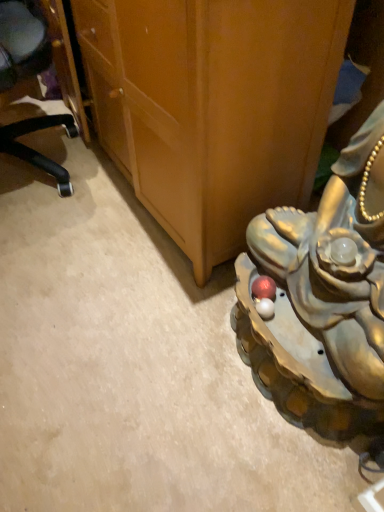
What do you see at coordinates (321, 297) in the screenshot? I see `metallic gold statue at lower right` at bounding box center [321, 297].

Identify the location of metallic gold statue at lower right. This screenshot has width=384, height=512. (321, 297).

You are a GUI agent. You are given a task and a screenshot of the screen. Output one action in this format:
    pyautogui.click(x=<x>, y=<y>)
    Task: Click on the metallic gold statue at lower right
    
    Given the screenshot: What is the action you would take?
    pyautogui.click(x=321, y=297)